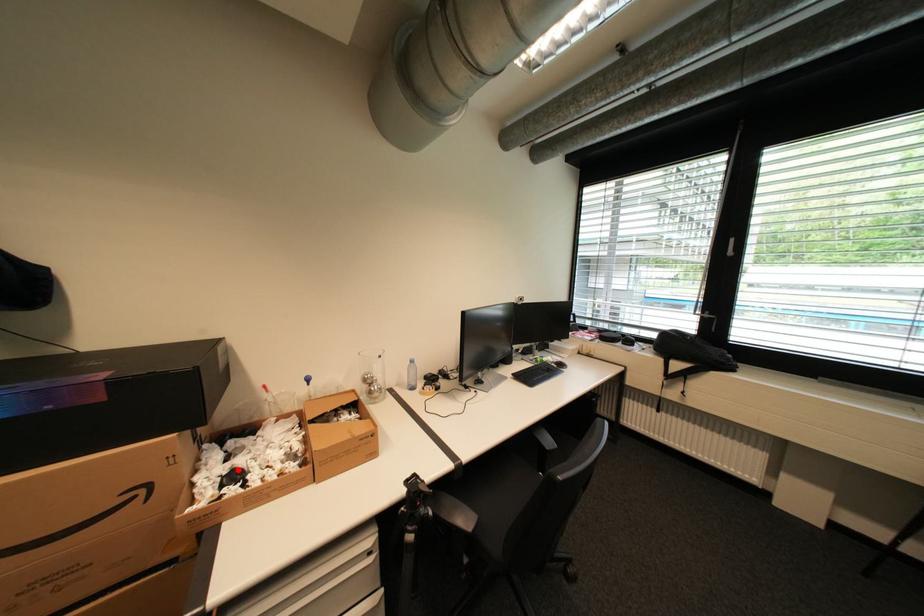
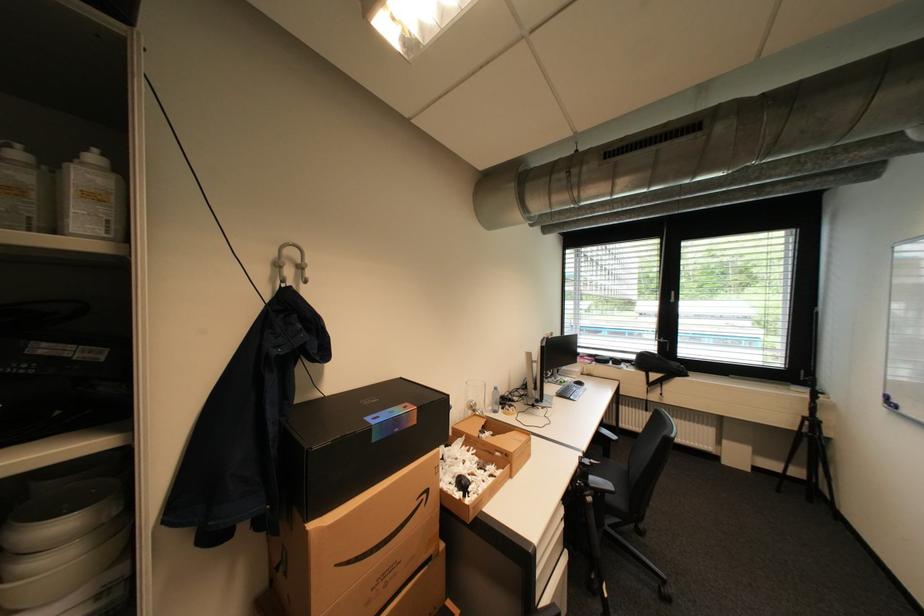
Question: I am providing you with two images of the same scene from different viewpoints. A red point is marked on the first image. Can you still see the location of the red point in image 2?

Choices:
 (A) Yes
 (B) No

Answer: (A)